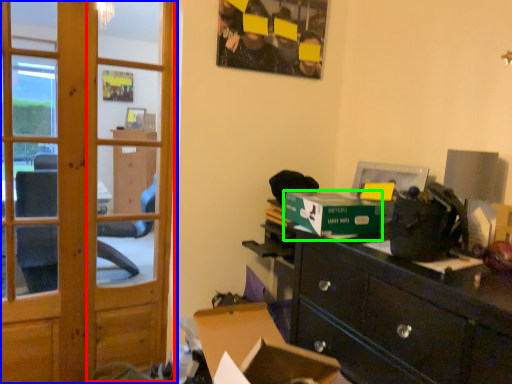
Question: Which object is positioned closest to screen door (highlighted by a red box)? Select from door (highlighted by a blue box) and cardboard box (highlighted by a green box).

Choices:
 (A) door
 (B) cardboard box

Answer: (A)